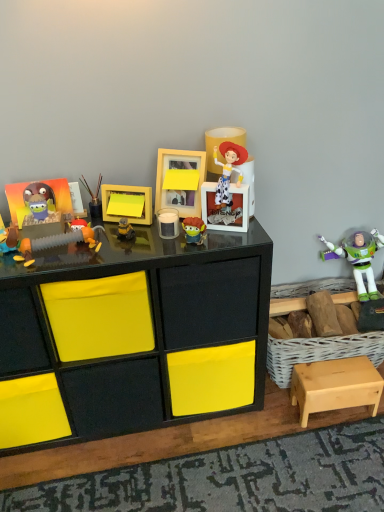
Identify the location of free space in front of yellow matte toy at center, the 3th toy in the right-to-left sequence. (119, 259).